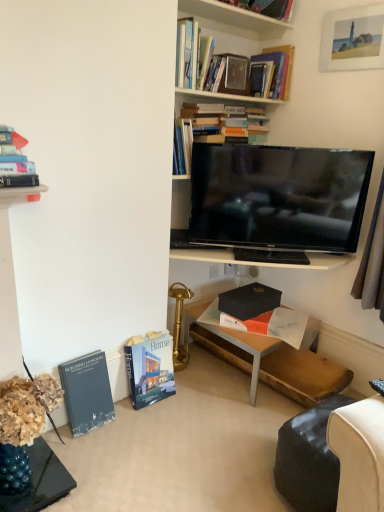
Image resolution: width=384 pixels, height=512 pixels. In order to click on black matte box at center, which is counted as the 4th book, starting from the top in this screenshot , I will do `click(249, 301)`.

In order to click on hardcover book at lower left, positioned as the second book in bottom-to-top order in this screenshot , I will do `click(150, 370)`.

What do you see at coordinates (232, 19) in the screenshot? This screenshot has height=512, width=384. I see `wooden bookshelf at upper center` at bounding box center [232, 19].

At what (x,y) coordinates should I click in order to perform the action: click on hardcover book at lower left, the 6th book viewed from the top. Please return your answer as a coordinate pair (x, y). Image resolution: width=384 pixels, height=512 pixels. Looking at the image, I should click on (87, 392).

The width and height of the screenshot is (384, 512). Describe the element at coordinates (87, 392) in the screenshot. I see `hardcover book at lower left, the 6th book viewed from the top` at that location.

Identify the location of leather swivel chair at lower right. The height and width of the screenshot is (512, 384). (309, 459).

Which object is closer to the camera, black matte box at center, which is counted as the 4th book, starting from the top, or hardcover books at upper center, arranged as the 2th book when viewed from the top?

hardcover books at upper center, arranged as the 2th book when viewed from the top, is in front.

Based on their positions, is black matte box at center, which appears as the 3th book when ordered from the bottom, located to the left or right of hardcover books at upper center, the fifth book positioned from the bottom?

In the image, black matte box at center, which appears as the 3th book when ordered from the bottom, appears on the right side of hardcover books at upper center, the fifth book positioned from the bottom.

From the image's perspective, which is below, black matte box at center, which is counted as the 4th book, starting from the top, or hardcover books at upper center, arranged as the 2th book when viewed from the top?

From the image's view, black matte box at center, which is counted as the 4th book, starting from the top, is below.

Which object is wider, black matte box at center, which appears as the 3th book when ordered from the bottom, or hardcover books at upper center, arranged as the 2th book when viewed from the top?

black matte box at center, which appears as the 3th book when ordered from the bottom.

From the picture: Considering the relative sizes of hardcover book at upper center, placed as the 1th book when sorted from top to bottom, and black glossy tv at upper center in the image provided, is hardcover book at upper center, placed as the 1th book when sorted from top to bottom, shorter than black glossy tv at upper center?

Indeed, hardcover book at upper center, placed as the 1th book when sorted from top to bottom, has a lesser height compared to black glossy tv at upper center.

Considering the sizes of objects hardcover book at upper center, placed as the 1th book when sorted from top to bottom, and black glossy tv at upper center in the image provided, who is thinner, hardcover book at upper center, placed as the 1th book when sorted from top to bottom, or black glossy tv at upper center?

Thinner between the two is hardcover book at upper center, placed as the 1th book when sorted from top to bottom.

Is hardcover book at upper center, the sixth book in the bottom-to-top sequence, looking in the opposite direction of black glossy tv at upper center?

That's not correct — hardcover book at upper center, the sixth book in the bottom-to-top sequence, is not looking away from black glossy tv at upper center.

Locate an element on the screen. television in front of the hardcover book at upper center, placed as the 1th book when sorted from top to bottom is located at coordinates (278, 197).

How different are the orientations of wooden bookshelf at upper center and hardcover book at lower left, the 6th book viewed from the top, in degrees?

The angle between the facing direction of wooden bookshelf at upper center and the facing direction of hardcover book at lower left, the 6th book viewed from the top, is 1.39 degrees.

Between wooden bookshelf at upper center and hardcover book at lower left, arranged as the first book when ordered from the bottom, which one has more height?

With more height is hardcover book at lower left, arranged as the first book when ordered from the bottom.

The height and width of the screenshot is (512, 384). I want to click on the 3rd book to the left of the wooden bookshelf at upper center, counting from the anchor's position, so click(87, 392).

Visually, is wooden bookshelf at upper center positioned to the left or to the right of hardcover book at lower left, the 6th book viewed from the top?

wooden bookshelf at upper center is positioned on hardcover book at lower left, the 6th book viewed from the top,'s right side.

Find the location of a particular element. swivel chair below the matte black table at center (from the image's perspective) is located at coordinates (309, 459).

Considering the sizes of leather swivel chair at lower right and matte black table at center in the image, is leather swivel chair at lower right bigger or smaller than matte black table at center?

Considering their sizes, leather swivel chair at lower right takes up less space than matte black table at center.

Looking at their sizes, would you say leather swivel chair at lower right is wider or thinner than matte black table at center?

Considering their sizes, leather swivel chair at lower right looks slimmer than matte black table at center.

Is leather swivel chair at lower right positioned with its back to matte black table at center?

leather swivel chair at lower right does not have its back to matte black table at center.

Are hardcover books at upper center, the fifth book positioned from the bottom, and matte black table at center beside each other?

hardcover books at upper center, the fifth book positioned from the bottom, and matte black table at center are not in contact.

Can you tell me how much hardcover books at upper center, the fifth book positioned from the bottom, and matte black table at center differ in facing direction?

The facing directions of hardcover books at upper center, the fifth book positioned from the bottom, and matte black table at center are 3.17 degrees apart.

Considering the sizes of hardcover books at upper center, the fifth book positioned from the bottom, and matte black table at center in the image, is hardcover books at upper center, the fifth book positioned from the bottom, taller or shorter than matte black table at center?

In the image, hardcover books at upper center, the fifth book positioned from the bottom, appears to be shorter than matte black table at center.

Consider the image. Is hardcover books at upper center, arranged as the 2th book when viewed from the top, bigger or smaller than matte black table at center?

hardcover books at upper center, arranged as the 2th book when viewed from the top, is smaller than matte black table at center.

Which object is thinner, wooden bookshelf at upper center or hardcover book at upper left, arranged as the third book when viewed from the top?

Thinner between the two is wooden bookshelf at upper center.

Can you confirm if wooden bookshelf at upper center is shorter than hardcover book at upper left, which is the 4th book in bottom-to-top order?

Correct, wooden bookshelf at upper center is not as tall as hardcover book at upper left, which is the 4th book in bottom-to-top order.

Relative to hardcover book at upper left, arranged as the third book when viewed from the top, is wooden bookshelf at upper center in front or behind?

Visually, wooden bookshelf at upper center is located behind hardcover book at upper left, arranged as the third book when viewed from the top.

In the scene shown: Is hardcover book at lower left, positioned as the second book in bottom-to-top order, beside matte black table at center?

No.

There is a hardcover book at lower left, positioned as the second book in bottom-to-top order. At what (x,y) coordinates should I click in order to perform the action: click on table above it (from a real-world perspective). Please return your answer as a coordinate pair (x, y). The width and height of the screenshot is (384, 512). Looking at the image, I should click on (270, 360).

Can you confirm if hardcover book at lower left, marked as the 5th book in a top-to-bottom arrangement, is smaller than matte black table at center?

Yes, hardcover book at lower left, marked as the 5th book in a top-to-bottom arrangement, is smaller than matte black table at center.

Where is `book that is the 2nd object located above the black matte box at center, which is counted as the 4th book, starting from the top (from the image's perspective)`? book that is the 2nd object located above the black matte box at center, which is counted as the 4th book, starting from the top (from the image's perspective) is located at coordinates (227, 122).

Find the location of `television lying below the hardcover book at upper center, placed as the 1th book when sorted from top to bottom (from the image's perspective)`. television lying below the hardcover book at upper center, placed as the 1th book when sorted from top to bottom (from the image's perspective) is located at coordinates (278, 197).

Consider the image. Looking at the image, which one is located closer to black glossy tv at upper center, wooden bookshelf at upper center or hardcover book at upper left, which is the 4th book in bottom-to-top order?

Among the two, wooden bookshelf at upper center is located nearer to black glossy tv at upper center.

From the image, which object appears to be farther from hardcover book at upper left, arranged as the third book when viewed from the top, hardcover book at lower left, positioned as the second book in bottom-to-top order, or matte white picture frame at upper right?

Among the two, matte white picture frame at upper right is located further to hardcover book at upper left, arranged as the third book when viewed from the top.

Estimate the real-world distances between objects in this image. Which object is closer to hardcover books at upper center, the fifth book positioned from the bottom, hardcover book at lower left, marked as the 5th book in a top-to-bottom arrangement, or black matte box at center, which appears as the 3th book when ordered from the bottom?

black matte box at center, which appears as the 3th book when ordered from the bottom, is positioned closer to the anchor hardcover books at upper center, the fifth book positioned from the bottom.

Looking at the image, which one is located further to matte black table at center, wooden bookshelf at upper center or hardcover books at upper center, the fifth book positioned from the bottom?

Based on the image, wooden bookshelf at upper center appears to be further to matte black table at center.

When comparing their distances from hardcover books at upper center, arranged as the 2th book when viewed from the top, does leather swivel chair at lower right or black glossy tv at upper center seem further?

The object further to hardcover books at upper center, arranged as the 2th book when viewed from the top, is leather swivel chair at lower right.

From the image, which object appears to be farther from hardcover book at upper left, arranged as the third book when viewed from the top, hardcover books at upper center, the fifth book positioned from the bottom, or leather swivel chair at lower right?

The object further to hardcover book at upper left, arranged as the third book when viewed from the top, is leather swivel chair at lower right.

Based on their spatial positions, is leather swivel chair at lower right or matte black table at center closer to black matte box at center, which is counted as the 4th book, starting from the top?

matte black table at center.

Considering their positions, is wooden bookshelf at upper center positioned closer to hardcover books at upper center, arranged as the 2th book when viewed from the top, than hardcover book at upper center, the sixth book in the bottom-to-top sequence?

Result: hardcover book at upper center, the sixth book in the bottom-to-top sequence, is closer to hardcover books at upper center, arranged as the 2th book when viewed from the top.

Where is `table located between hardcover book at upper left, which is the 4th book in bottom-to-top order, and leather swivel chair at lower right in the left-right direction`? This screenshot has height=512, width=384. table located between hardcover book at upper left, which is the 4th book in bottom-to-top order, and leather swivel chair at lower right in the left-right direction is located at coordinates (270, 360).

In order to click on television that lies between hardcover book at upper center, placed as the 1th book when sorted from top to bottom, and matte black table at center from top to bottom in this screenshot , I will do `click(278, 197)`.

Find the location of a particular element. This screenshot has width=384, height=512. table located between hardcover book at lower left, arranged as the first book when ordered from the bottom, and black glossy tv at upper center in the left-right direction is located at coordinates (270, 360).

This screenshot has height=512, width=384. I want to click on television between matte white picture frame at upper right and matte black table at center vertically, so click(x=278, y=197).